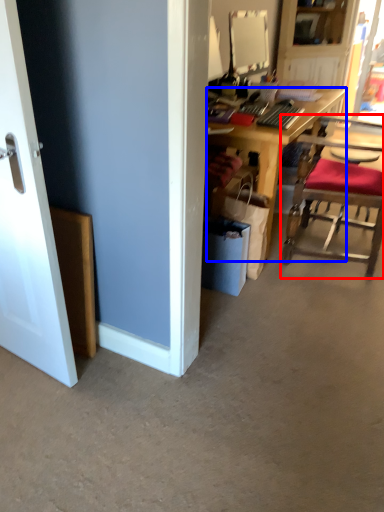
Question: Which object appears farthest to the camera in this image, chair (highlighted by a red box) or desk (highlighted by a blue box)?

Choices:
 (A) chair
 (B) desk

Answer: (B)